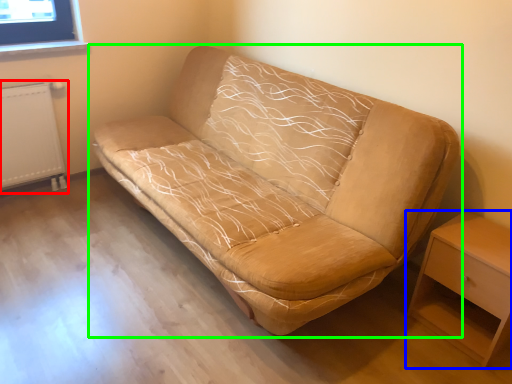
Question: Which object is positioned closest to radiator (highlighted by a red box)? Select from nightstand (highlighted by a blue box) and studio couch (highlighted by a green box).

Choices:
 (A) nightstand
 (B) studio couch

Answer: (B)